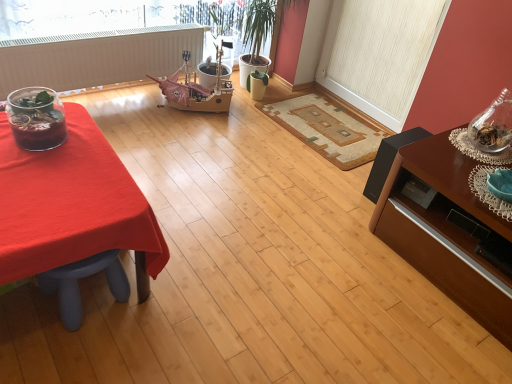
Question: Should I look upward or downward to see white textured screen door at upper right?

Choices:
 (A) down
 (B) up

Answer: (B)

Question: Is translucent glass terrarium at left to the right of brown wood table at right from the viewer's perspective?

Choices:
 (A) no
 (B) yes

Answer: (A)

Question: From the image's perspective, is translucent glass terrarium at left on top of brown wood table at right?

Choices:
 (A) yes
 (B) no

Answer: (A)

Question: From a real-world perspective, does translucent glass terrarium at left stand above brown wood table at right?

Choices:
 (A) yes
 (B) no

Answer: (A)

Question: Considering the relative sizes of translucent glass terrarium at left and brown wood table at right in the image provided, is translucent glass terrarium at left smaller than brown wood table at right?

Choices:
 (A) no
 (B) yes

Answer: (B)

Question: Does translucent glass terrarium at left lie in front of brown wood table at right?

Choices:
 (A) yes
 (B) no

Answer: (B)

Question: Does translucent glass terrarium at left have a lesser height compared to brown wood table at right?

Choices:
 (A) yes
 (B) no

Answer: (A)

Question: Is beige woven mat at center taller than translucent glass terrarium at left?

Choices:
 (A) no
 (B) yes

Answer: (A)

Question: Is beige woven mat at center to the left of translucent glass terrarium at left from the viewer's perspective?

Choices:
 (A) yes
 (B) no

Answer: (B)

Question: Does beige woven mat at center come behind translucent glass terrarium at left?

Choices:
 (A) yes
 (B) no

Answer: (A)

Question: Can you confirm if beige woven mat at center is shorter than translucent glass terrarium at left?

Choices:
 (A) no
 (B) yes

Answer: (B)

Question: Does beige woven mat at center appear on the right side of translucent glass terrarium at left?

Choices:
 (A) no
 (B) yes

Answer: (B)

Question: Is beige woven mat at center next to translucent glass terrarium at left?

Choices:
 (A) no
 (B) yes

Answer: (A)

Question: From a real-world perspective, is white matte radiator at upper left on top of white textured screen door at upper right?

Choices:
 (A) no
 (B) yes

Answer: (A)